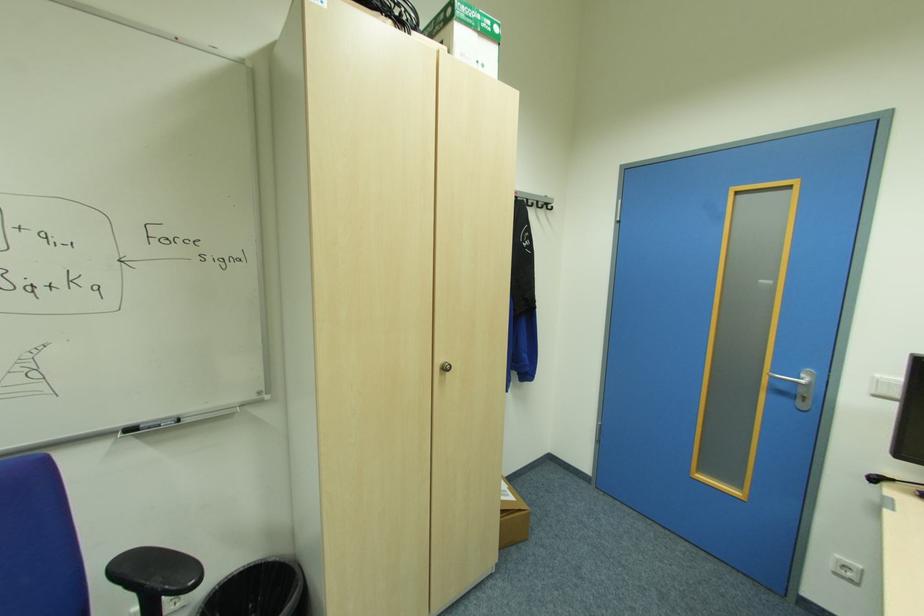
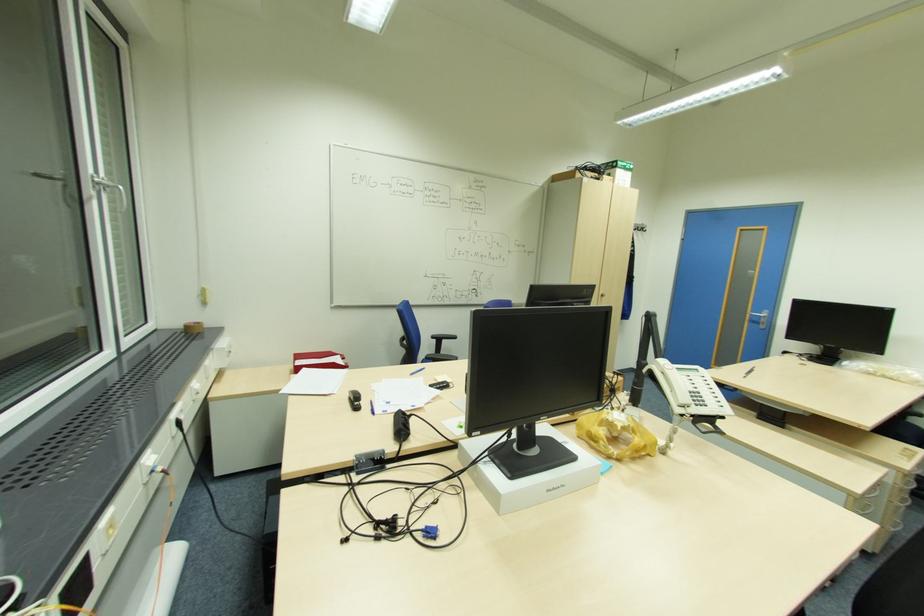
In the second image, find the point that corresponds to (447,368) in the first image.

(604, 294)